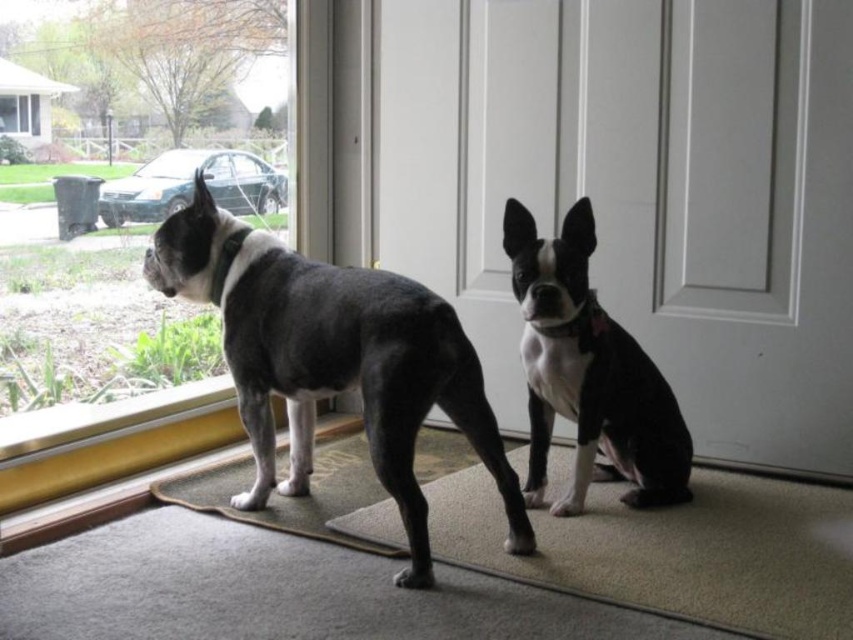
Between black and white fur dog at left and transparent glass window at upper left, which one has less height?

transparent glass window at upper left

Measure the distance between black and white fur dog at left and transparent glass window at upper left.

The distance of black and white fur dog at left from transparent glass window at upper left is 1.02 meters.

Is point (247, 269) positioned after point (38, 125)?

No, (247, 269) is closer to viewer.

In order to click on black and white fur dog at left in this screenshot , I will do `click(334, 358)`.

Locate an element on the screen. white glossy door at center is located at coordinates (642, 192).

Between white glossy door at center and carpeted mat at lower center, which one appears on the right side from the viewer's perspective?

From the viewer's perspective, white glossy door at center appears more on the right side.

Find the location of `white glossy door at center`. white glossy door at center is located at coordinates (642, 192).

Is carpet at lower center shorter than carpeted mat at lower center?

Correct, carpet at lower center is not as tall as carpeted mat at lower center.

Does carpet at lower center appear on the left side of carpeted mat at lower center?

Incorrect, carpet at lower center is not on the left side of carpeted mat at lower center.

Where is `carpet at lower center`? This screenshot has height=640, width=853. carpet at lower center is located at coordinates (674, 550).